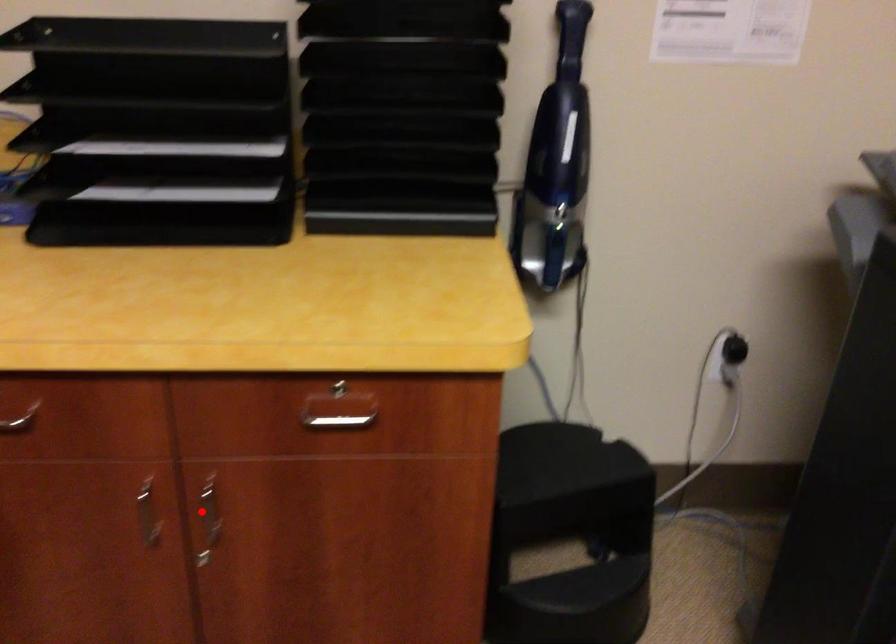
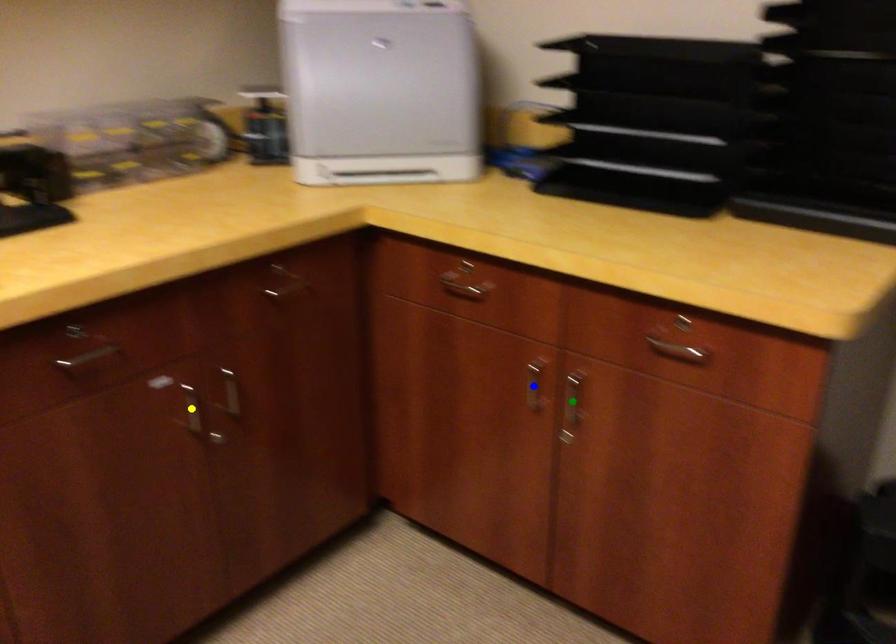
Question: I am providing you with two images of the same scene from different viewpoints. A red point is marked on the first image. You are given multiple points on the second image. Which mark in image 2 goes with the point in image 1?

Choices:
 (A) yellow point
 (B) blue point
 (C) green point

Answer: (C)